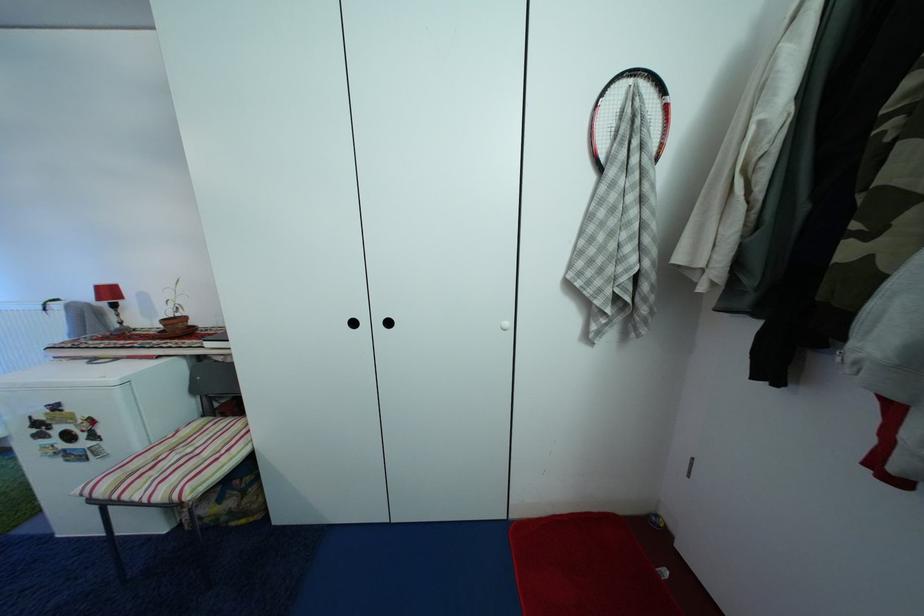
Where would you pull the white cabinet knob? Please return your answer as a coordinate pair (x, y).

(505, 325)